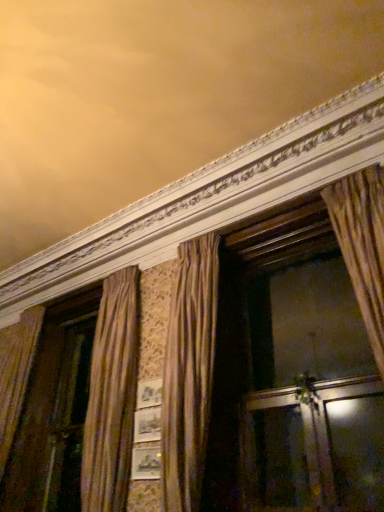
Question: From the image's perspective, is transparent glass screen door at lower right below gold textured curtain at center?

Choices:
 (A) no
 (B) yes

Answer: (B)

Question: Is transparent glass screen door at lower right surrounding gold textured curtain at center?

Choices:
 (A) yes
 (B) no

Answer: (B)

Question: From a real-world perspective, is transparent glass screen door at lower right below gold textured curtain at center?

Choices:
 (A) yes
 (B) no

Answer: (A)

Question: Can you confirm if transparent glass screen door at lower right is wider than gold textured curtain at center?

Choices:
 (A) no
 (B) yes

Answer: (A)

Question: Considering the relative positions of transparent glass screen door at lower right and gold textured curtain at center in the image provided, is transparent glass screen door at lower right behind gold textured curtain at center?

Choices:
 (A) no
 (B) yes

Answer: (A)

Question: Is transparent glass screen door at lower right located outside gold textured curtain at center?

Choices:
 (A) yes
 (B) no

Answer: (A)

Question: From a real-world perspective, is gold textured curtain at center located higher than transparent glass screen door at lower right?

Choices:
 (A) yes
 (B) no

Answer: (A)

Question: Is gold textured curtain at center positioned before transparent glass screen door at lower right?

Choices:
 (A) yes
 (B) no

Answer: (B)

Question: Is gold textured curtain at center thinner than transparent glass screen door at lower right?

Choices:
 (A) yes
 (B) no

Answer: (B)

Question: Can you confirm if gold textured curtain at center is bigger than transparent glass screen door at lower right?

Choices:
 (A) yes
 (B) no

Answer: (A)

Question: Is gold textured curtain at center positioned with its back to transparent glass screen door at lower right?

Choices:
 (A) no
 (B) yes

Answer: (A)

Question: Does gold textured curtain at center lie behind transparent glass screen door at lower right?

Choices:
 (A) yes
 (B) no

Answer: (A)

Question: Do you think transparent glass screen door at lower right is within gold textured curtain at center, or outside of it?

Choices:
 (A) inside
 (B) outside

Answer: (B)